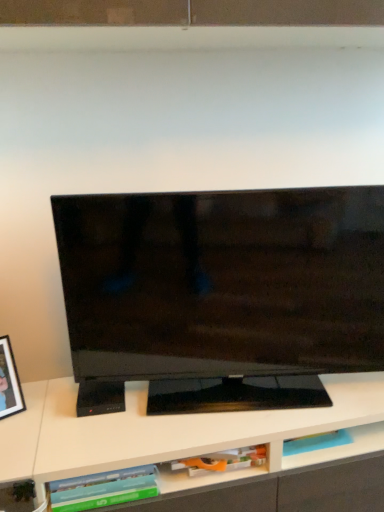
Question: Do you think black matte picture frame at left is within matte orange book at lower center, the 2th book from the left, or outside of it?

Choices:
 (A) outside
 (B) inside

Answer: (A)

Question: Is black matte picture frame at left taller or shorter than matte orange book at lower center, the 2th book from the left?

Choices:
 (A) short
 (B) tall

Answer: (B)

Question: Which object is the closest to the black matte picture frame at left?

Choices:
 (A) matte orange book at lower center, which is the 1th book from right to left
 (B) green matte book at lower center, positioned as the 1th book in left-to-right order
 (C) black glossy tv at center

Answer: (B)

Question: Based on their relative distances, which object is nearer to the matte orange book at lower center, the 2th book from the left?

Choices:
 (A) green matte book at lower center, positioned as the 1th book in left-to-right order
 (B) black matte picture frame at left
 (C) black glossy tv at center

Answer: (A)